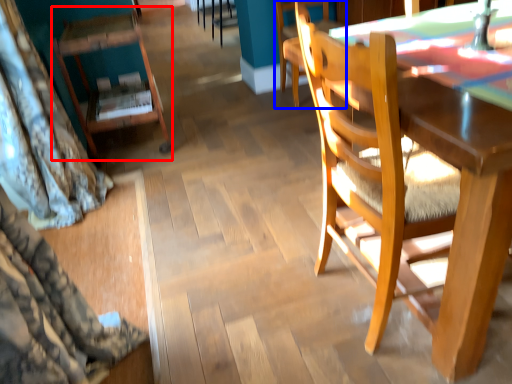
Question: Among these objects, which one is nearest to the camera, chair (highlighted by a red box) or chair (highlighted by a blue box)?

Choices:
 (A) chair
 (B) chair

Answer: (A)